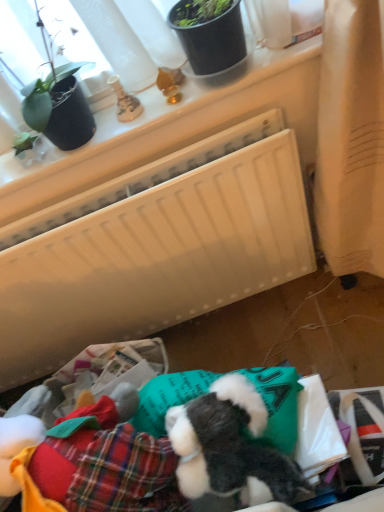
Describe the element at coordinates (20, 40) in the screenshot. I see `green matte plant at upper left` at that location.

Where is `green matte plant at upper left`? The image size is (384, 512). green matte plant at upper left is located at coordinates (20, 40).

Identify the location of green matte plant at upper left. This screenshot has width=384, height=512. (20, 40).